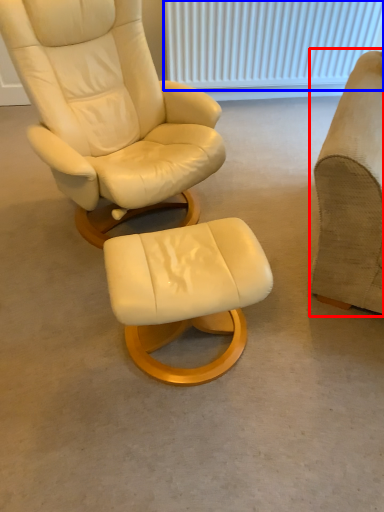
Question: Which object appears farthest to the camera in this image, chair (highlighted by a red box) or radiator (highlighted by a blue box)?

Choices:
 (A) chair
 (B) radiator

Answer: (B)